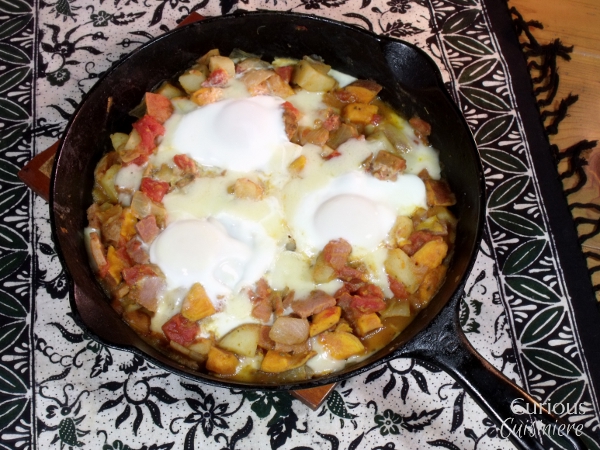
This screenshot has width=600, height=450. In order to click on potholder in this screenshot , I will do `click(28, 175)`.